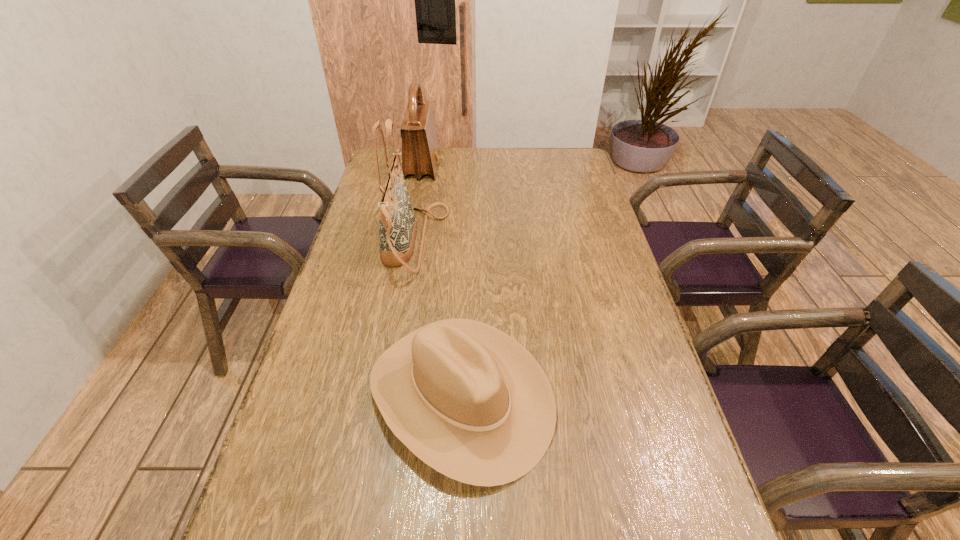
Locate an element on the screen. handbag at the left edge is located at coordinates (397, 224).

Locate an element on the screen. The height and width of the screenshot is (540, 960). shoulder bag at the left edge is located at coordinates (420, 151).

Identify the location of object located in the far left corner section of the desktop. (420, 151).

You are a GUI agent. You are given a task and a screenshot of the screen. Output one action in this format:
    pyautogui.click(x=<x>, y=<y>)
    Task: Click on the vacant position at the far edge of the desktop
    The width and height of the screenshot is (960, 540).
    Given the screenshot: What is the action you would take?
    pyautogui.click(x=461, y=159)

Find the location of a particular element. This screenshot has height=540, width=960. free location at the left edge is located at coordinates (378, 239).

Locate an element on the screen. The width and height of the screenshot is (960, 540). blank space at the far right corner of the desktop is located at coordinates (573, 156).

Locate an element on the screen. This screenshot has width=960, height=540. vacant space that is in between the shortest object and the second tallest object is located at coordinates tap(442, 281).

Identify the location of unoccupied area between the second nearest object and the cowboy hat. This screenshot has height=540, width=960. (438, 318).

This screenshot has height=540, width=960. I want to click on free space between the handbag and the nearest object, so click(438, 318).

The width and height of the screenshot is (960, 540). Identify the location of unoccupied position between the handbag and the cowboy hat. (438, 318).